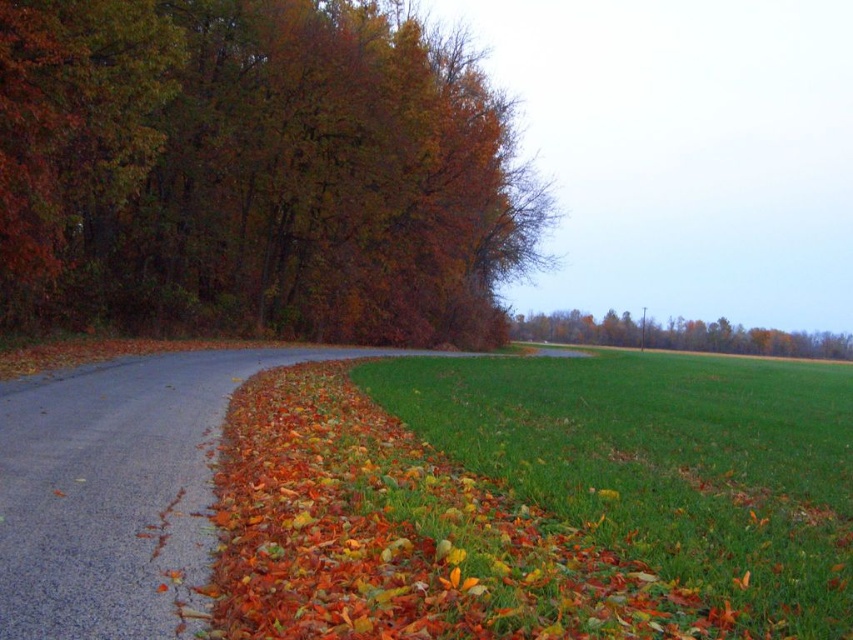
You are standing at the edge of the gray asphalt road at lower left and want to walk to the green leafy tree at center. Which direction should you head to reach the tree?

The gray asphalt road at lower left is positioned over the green leafy tree at center, so you should walk towards the center of the image to reach the tree.

You are standing at the edge of the paved road on the left side of the image. You want to walk towards the green grass at lower right and the green leafy tree at center. Which object will you encounter first?

You will encounter the green grass at lower right first because it is closer to you than the green leafy tree at center, which is further away.

You are standing on the paved road in the autumn scene. You see the green grass at lower right and the green leafy tree at center. Which object is nearer to you?

The green grass at lower right is closer to the viewer than the green leafy tree at center.